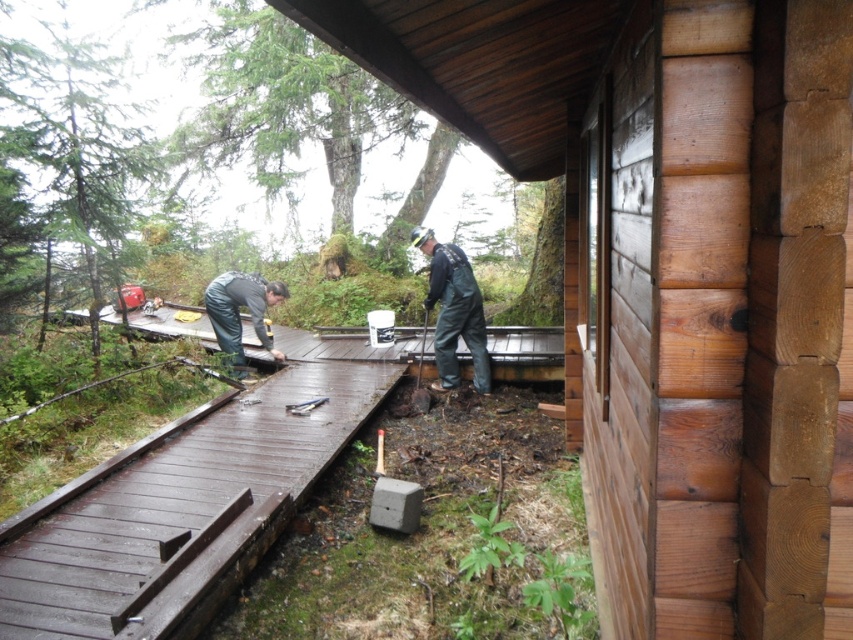
Question: Can you confirm if smooth wooden log cabin at center is positioned below dark gray rubber boots at lower center?

Choices:
 (A) yes
 (B) no

Answer: (A)

Question: Estimate the real-world distances between objects in this image. Which object is farther from the dark gray rubber boots at center?

Choices:
 (A) dark brown wood deck at center
 (B) metallic silver hammer at lower center
 (C) smooth wooden log cabin at center

Answer: (C)

Question: Can you confirm if smooth wooden log cabin at center is bigger than dark brown wooden porch at center?

Choices:
 (A) no
 (B) yes

Answer: (B)

Question: Can you confirm if smooth wooden log cabin at center is bigger than dark gray rubber boots at center?

Choices:
 (A) no
 (B) yes

Answer: (B)

Question: Which point appears closest to the camera in this image?

Choices:
 (A) click(x=288, y=406)
 (B) click(x=230, y=280)
 (C) click(x=517, y=372)

Answer: (A)

Question: Among these points, which one is nearest to the camera?

Choices:
 (A) (541, 372)
 (B) (305, 401)

Answer: (B)